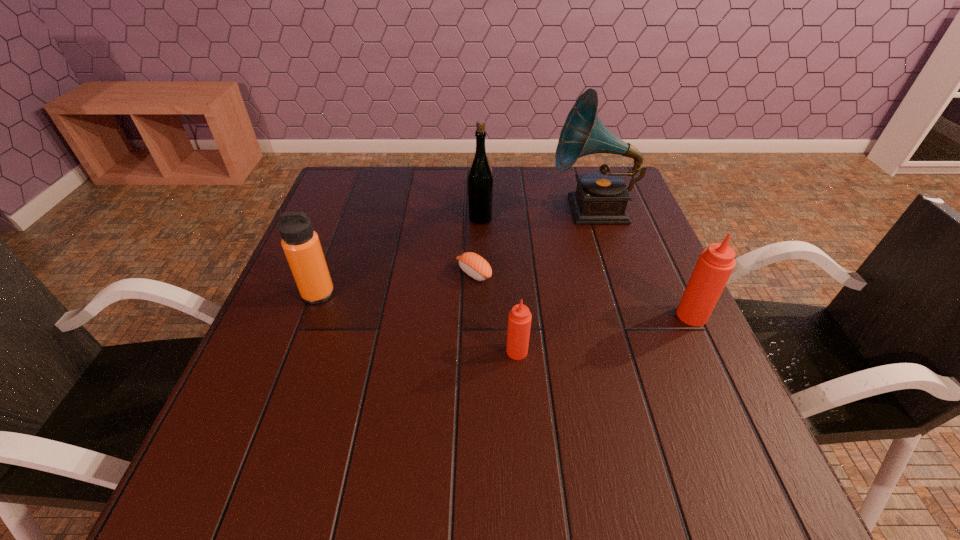
You are a GUI agent. You are given a task and a screenshot of the screen. Output one action in this format:
    pyautogui.click(x=<x>, y=<y>)
    Task: Click on the free space between the phonograph_record and the leftmost object
    The height and width of the screenshot is (540, 960).
    Given the screenshot: What is the action you would take?
    pyautogui.click(x=455, y=252)

Image resolution: width=960 pixels, height=540 pixels. I want to click on free space between the taller Tabasco sauce and the beer bottle, so click(x=587, y=267).

Where is `vacant area that lies between the taller Tabasco sauce and the phonograph_record`? vacant area that lies between the taller Tabasco sauce and the phonograph_record is located at coordinates (642, 262).

In order to click on vacant region between the right Tabasco sauce and the thermos bottle in this screenshot , I will do `click(505, 305)`.

This screenshot has width=960, height=540. I want to click on free space between the shortest object and the nearest object, so click(495, 312).

This screenshot has height=540, width=960. Find the location of `vacant area between the sushi and the phonograph_record`. vacant area between the sushi and the phonograph_record is located at coordinates (533, 241).

The image size is (960, 540). Find the location of `free point between the phonograph_record and the thermos bottle`. free point between the phonograph_record and the thermos bottle is located at coordinates (455, 252).

Identify the location of object that is the third nearest to the farther Tabasco sauce. (474, 265).

At what (x,y) coordinates should I click in order to perform the action: click on object that stands as the fourth closest to the fourth object from left to right. Please return your answer as a coordinate pair (x, y). Looking at the image, I should click on (301, 244).

Locate an element on the screen. The image size is (960, 540). free space in the image that satisfies the following two spatial constraints: 1. from the horn of the phonograph_record; 2. on the front side of the leftmost object is located at coordinates (620, 294).